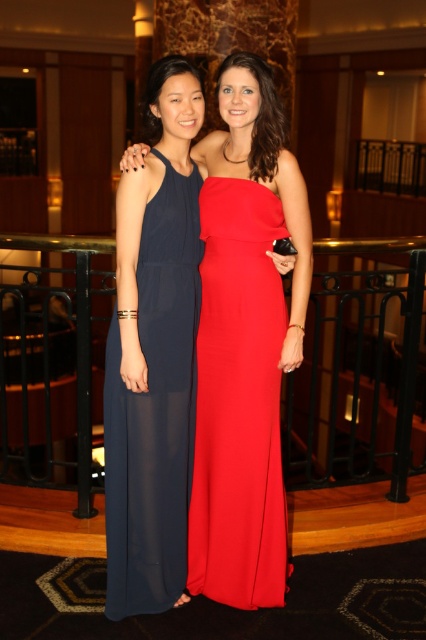
Does point (293, 401) lie in front of point (181, 371)?

No.

Is black metal balustrade at center taller than navy sheer dress at left?

Yes, black metal balustrade at center is taller than navy sheer dress at left.

Is point (104, 440) more distant than point (164, 419)?

Yes.

Find the location of `black metal balustrade at center`. black metal balustrade at center is located at coordinates (357, 369).

Can you confirm if matte red dress at center is bigger than navy sheer dress at left?

Indeed, matte red dress at center has a larger size compared to navy sheer dress at left.

Based on the photo, who is positioned more to the right, matte red dress at center or navy sheer dress at left?

Positioned to the right is matte red dress at center.

Is point (233, 284) positioned behind point (187, 300)?

That is False.

Locate an element on the screen. This screenshot has width=426, height=640. matte red dress at center is located at coordinates (238, 403).

Does black metal balustrade at center have a greater width compared to matte red dress at center?

Yes.

Between black metal balustrade at center and matte red dress at center, which one appears on the left side from the viewer's perspective?

Positioned to the left is black metal balustrade at center.

Identify the location of black metal balustrade at center. The width and height of the screenshot is (426, 640). (357, 369).

Image resolution: width=426 pixels, height=640 pixels. Identify the location of black metal balustrade at center. (357, 369).